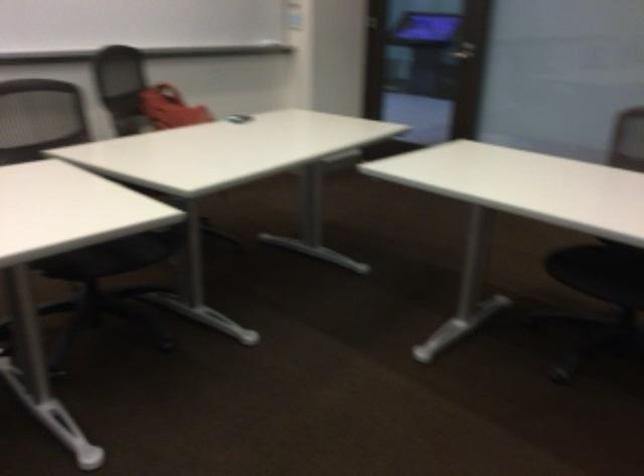
The location [169,107] corresponds to which object?

This point indicates the red bag.